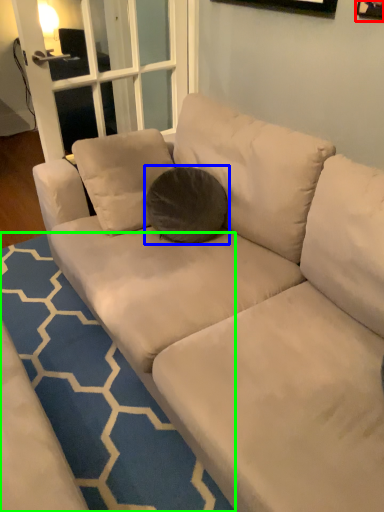
Question: Considering the real-world distances, which object is closest to picture frame (highlighted by a red box)? throw pillow (highlighted by a blue box) or doormat (highlighted by a green box).

Choices:
 (A) throw pillow
 (B) doormat

Answer: (A)